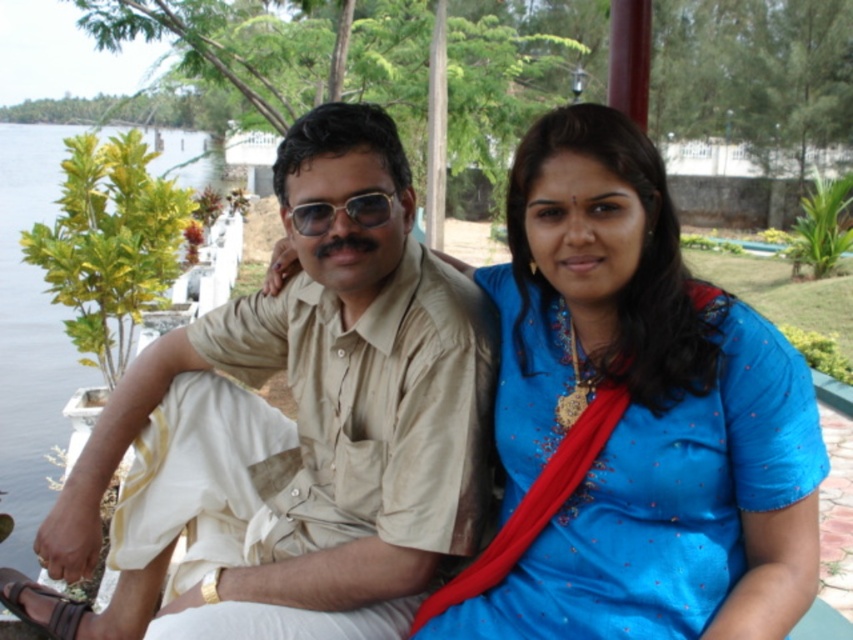
Question: Is green leafy water at left positioned behind matte plastic goggles at center?

Choices:
 (A) no
 (B) yes

Answer: (B)

Question: Which of the following is the farthest from the observer?

Choices:
 (A) green leafy water at left
 (B) beige cotton shirt at center
 (C) blue silk saree at center

Answer: (A)

Question: Which of these objects is positioned farthest from the green leafy water at left?

Choices:
 (A) matte plastic goggles at center
 (B) beige cotton shirt at center
 (C) blue silk saree at center

Answer: (A)

Question: Among these objects, which one is nearest to the camera?

Choices:
 (A) matte plastic goggles at center
 (B) blue silk saree at center
 (C) beige cotton shirt at center
 (D) green leafy water at left

Answer: (B)

Question: Does blue silk saree at center have a smaller size compared to green leafy water at left?

Choices:
 (A) yes
 (B) no

Answer: (A)

Question: Is blue silk saree at center above matte plastic goggles at center?

Choices:
 (A) yes
 (B) no

Answer: (B)